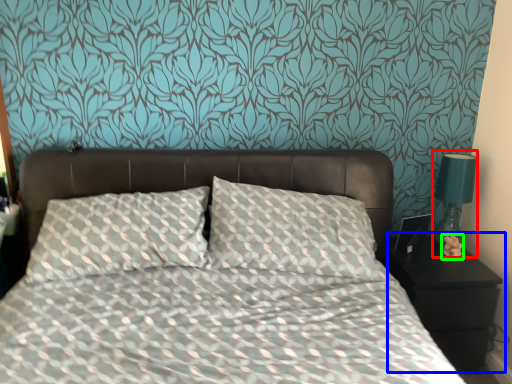
Question: Based on their relative distances, which object is farther from bedside lamp (highlighted by a red box)? Choose from nightstand (highlighted by a blue box) and flower (highlighted by a green box).

Choices:
 (A) nightstand
 (B) flower

Answer: (A)